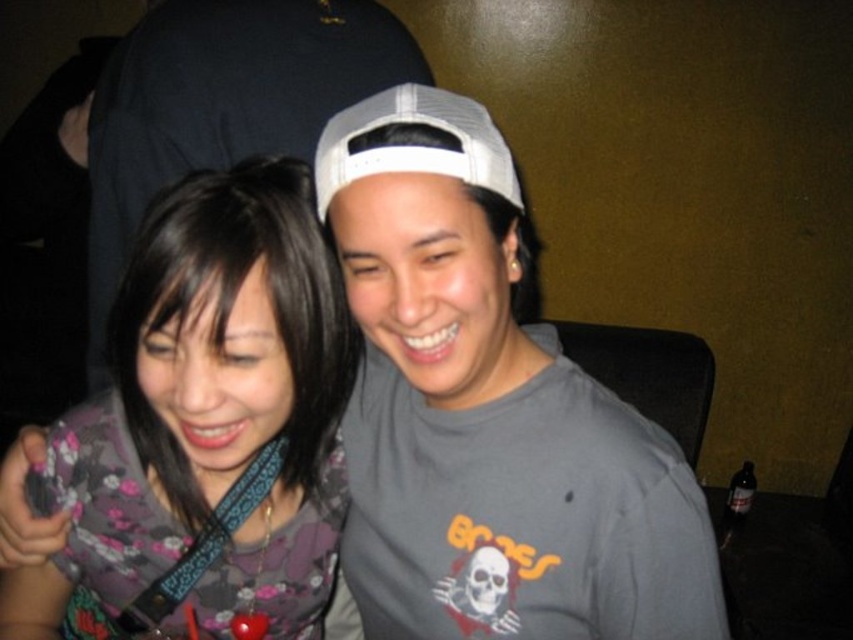
Which of these two, matte gray t-shirt at center or gray matte t-shirt at center, stands shorter?

Standing shorter between the two is matte gray t-shirt at center.

Between matte gray t-shirt at center and gray matte t-shirt at center, which one has more height?

gray matte t-shirt at center

Does point (425, 212) come farther from viewer compared to point (343, 38)?

No, (425, 212) is in front of (343, 38).

Where is `matte gray t-shirt at center`? The image size is (853, 640). matte gray t-shirt at center is located at coordinates (488, 412).

Does floral fabric shirt at center appear over gray matte t-shirt at center?

Incorrect, floral fabric shirt at center is not positioned above gray matte t-shirt at center.

Is point (300, 381) closer to viewer compared to point (186, 160)?

Yes, point (300, 381) is in front of point (186, 160).

Which is behind, point (57, 490) or point (291, 83)?

The point (291, 83) is behind.

Locate an element on the screen. The image size is (853, 640). floral fabric shirt at center is located at coordinates (207, 422).

Does point (352, 524) come behind point (177, 611)?

Yes.

At what (x,y) coordinates should I click in order to perform the action: click on matte gray t-shirt at center. Please return your answer as a coordinate pair (x, y). Looking at the image, I should click on (488, 412).

Is point (386, 428) closer to viewer compared to point (216, 378)?

No, it is not.

What are the coordinates of `matte gray t-shirt at center` in the screenshot? It's located at (488, 412).